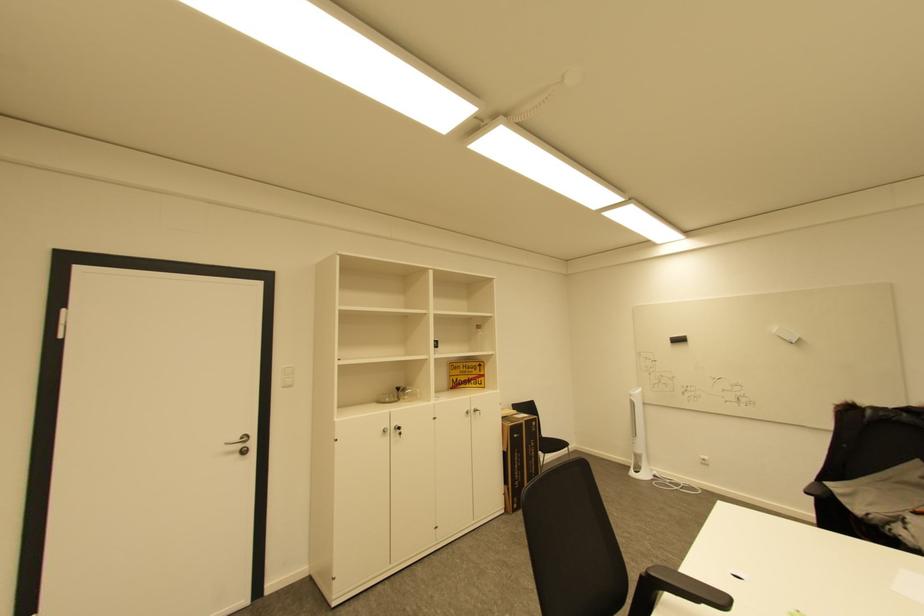
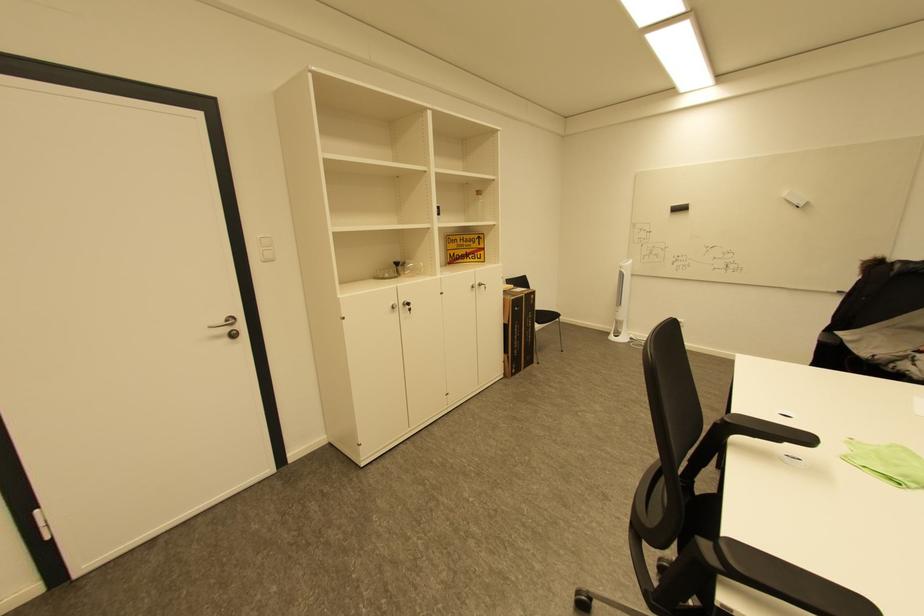
The point at (473, 413) is marked in the first image. Where is the corresponding point in the second image?

(479, 286)